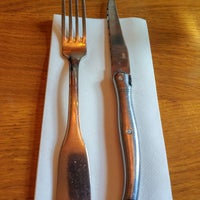
Where is `tabletop, wooden`? The height and width of the screenshot is (200, 200). tabletop, wooden is located at coordinates (175, 103).